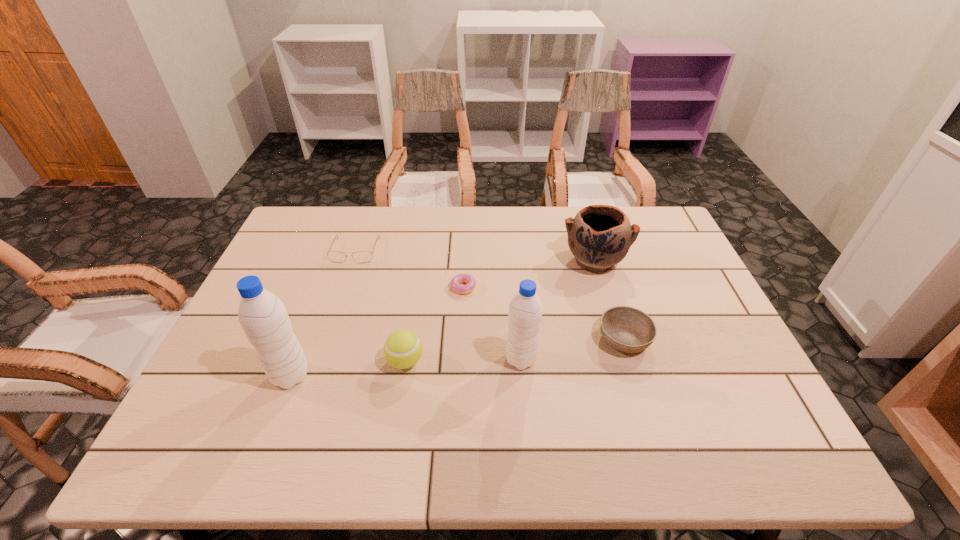
The image size is (960, 540). In order to click on object present at the near edge in this screenshot , I will do `click(262, 315)`.

Image resolution: width=960 pixels, height=540 pixels. I want to click on object located in the left edge section of the desktop, so click(262, 315).

Identify the location of object that is at the near left corner. Image resolution: width=960 pixels, height=540 pixels. (262, 315).

This screenshot has width=960, height=540. In the image, there is a desktop. What are the coordinates of `vacant area at the far edge` in the screenshot? It's located at (381, 246).

In the image, there is a desktop. At what (x,y) coordinates should I click in order to perform the action: click on free region at the left edge. Please return your answer as a coordinate pair (x, y). Image resolution: width=960 pixels, height=540 pixels. Looking at the image, I should click on (318, 262).

Identify the location of vacant space at the right edge of the desktop. Image resolution: width=960 pixels, height=540 pixels. (733, 341).

The width and height of the screenshot is (960, 540). I want to click on vacant area at the far left corner of the desktop, so click(314, 230).

Locate an element on the screen. The image size is (960, 540). vacant space at the far right corner of the desktop is located at coordinates (x=647, y=233).

The width and height of the screenshot is (960, 540). In order to click on vacant space at the near right corner of the desktop in this screenshot , I will do `click(762, 393)`.

You are a GUI agent. You are given a task and a screenshot of the screen. Output one action in this format:
    pyautogui.click(x=<x>, y=<y>)
    Task: Click on the free space between the fifth tallest object and the sixth tallest object
    
    Given the screenshot: What is the action you would take?
    pyautogui.click(x=490, y=295)